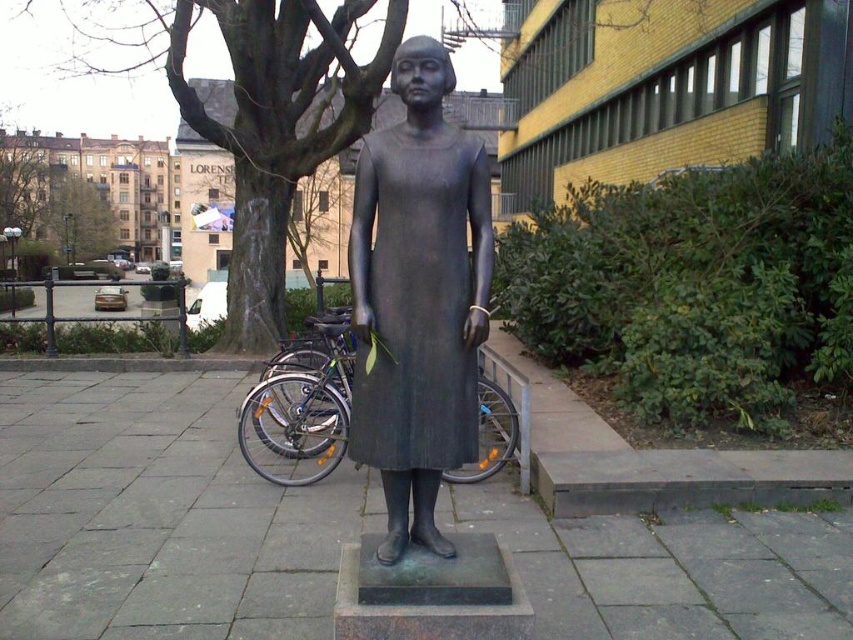
Is matte bronze statue at center below green leafy tree at upper center?

Yes.

Does matte bronze statue at center have a lesser height compared to green leafy tree at upper center?

Yes.

Between point (398, 336) and point (86, 227), which one is positioned behind?

The point (86, 227) is more distant.

Identify the location of matte bronze statue at center. pos(418,296).

The image size is (853, 640). Describe the element at coordinates (276, 125) in the screenshot. I see `dark brown bark tree at upper left` at that location.

Does dark brown bark tree at upper left lie behind green leafy tree at upper center?

That is False.

Who is more distant from viewer, (379, 61) or (93, 221)?

The point (93, 221) is more distant.

This screenshot has width=853, height=640. I want to click on dark brown bark tree at upper left, so (276, 125).

Does point (409, 173) come closer to viewer compared to point (287, 124)?

Yes.

Does matte bronze statue at center have a lesser height compared to dark brown bark tree at upper left?

Yes.

Locate an element on the screen. Image resolution: width=853 pixels, height=640 pixels. matte bronze statue at center is located at coordinates (418, 296).

At what (x,y) coordinates should I click in order to perform the action: click on matte bronze statue at center. Please return your answer as a coordinate pair (x, y). This screenshot has width=853, height=640. Looking at the image, I should click on (418, 296).